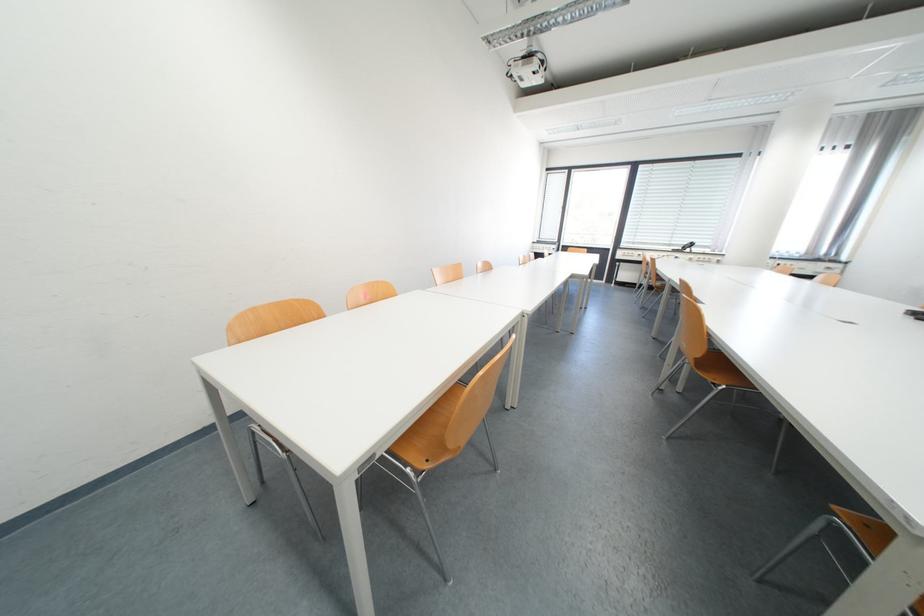
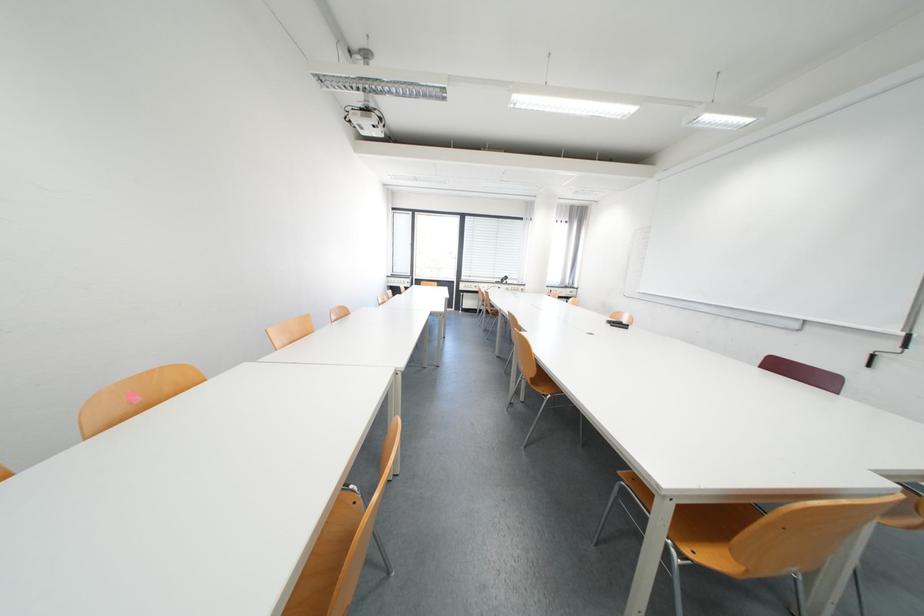
Where in the second image is the point corresponding to (x=845, y=507) from the first image?

(629, 474)